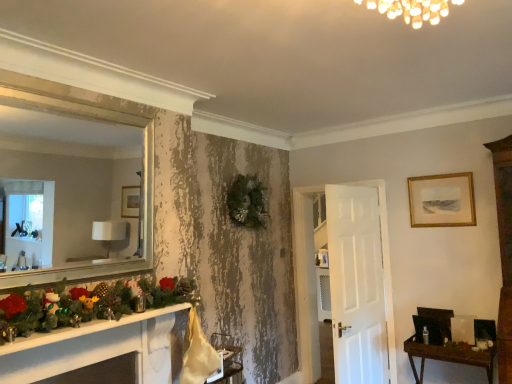
Question: From the image's perspective, is brown wooden table at lower right beneath gold-framed painting at upper right?

Choices:
 (A) yes
 (B) no

Answer: (A)

Question: Is brown wooden table at lower right positioned in front of gold-framed painting at upper right?

Choices:
 (A) yes
 (B) no

Answer: (A)

Question: Considering the relative sizes of brown wooden table at lower right and gold-framed painting at upper right in the image provided, is brown wooden table at lower right wider than gold-framed painting at upper right?

Choices:
 (A) no
 (B) yes

Answer: (B)

Question: Does brown wooden table at lower right have a lesser height compared to gold-framed painting at upper right?

Choices:
 (A) no
 (B) yes

Answer: (A)

Question: Can you confirm if brown wooden table at lower right is positioned to the right of gold-framed painting at upper right?

Choices:
 (A) yes
 (B) no

Answer: (B)

Question: Is brown wooden table at lower right directly adjacent to gold-framed painting at upper right?

Choices:
 (A) yes
 (B) no

Answer: (B)

Question: Is there a large distance between gold-framed painting at upper right and brown wooden table at lower right?

Choices:
 (A) yes
 (B) no

Answer: (A)

Question: Considering the relative sizes of gold-framed painting at upper right and brown wooden table at lower right in the image provided, is gold-framed painting at upper right bigger than brown wooden table at lower right?

Choices:
 (A) no
 (B) yes

Answer: (A)

Question: From a real-world perspective, is gold-framed painting at upper right beneath brown wooden table at lower right?

Choices:
 (A) yes
 (B) no

Answer: (B)

Question: Is brown wooden table at lower right a part of gold-framed painting at upper right?

Choices:
 (A) no
 (B) yes

Answer: (A)

Question: Is gold-framed painting at upper right positioned in front of brown wooden table at lower right?

Choices:
 (A) yes
 (B) no

Answer: (B)

Question: Does gold-framed painting at upper right have a greater width compared to brown wooden table at lower right?

Choices:
 (A) yes
 (B) no

Answer: (B)

Question: Considering their positions, is brown wooden table at lower right located in front of or behind gold-framed painting at upper right?

Choices:
 (A) front
 (B) behind

Answer: (A)